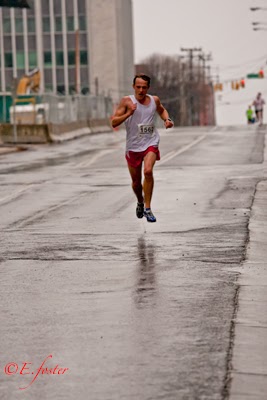
The image size is (267, 400). I want to click on red lights, so click(x=260, y=70), click(x=242, y=81).